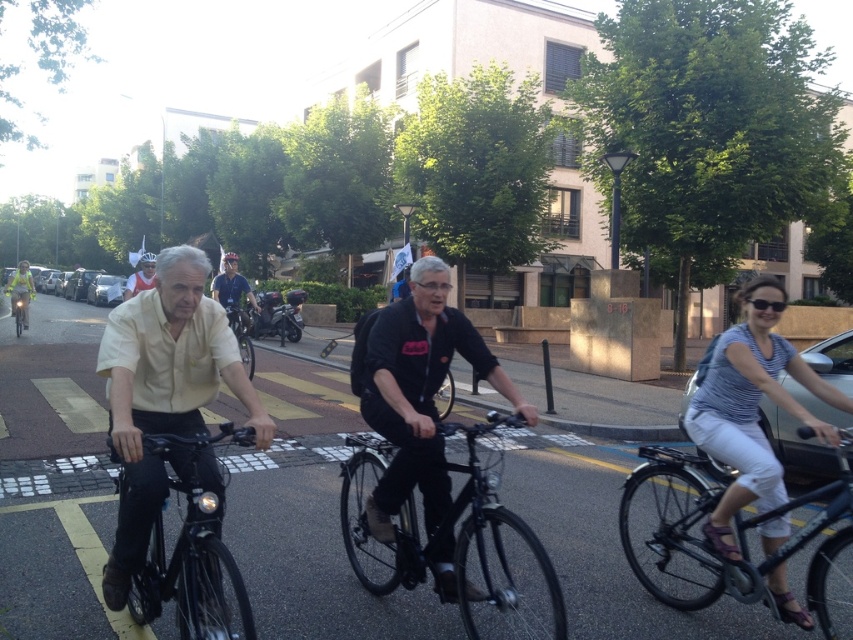
Who is higher up, striped cotton shirt at right or matte blue helmet at center?

striped cotton shirt at right is higher up.

Does striped cotton shirt at right have a lesser width compared to matte blue helmet at center?

No, striped cotton shirt at right is not thinner than matte blue helmet at center.

The width and height of the screenshot is (853, 640). What do you see at coordinates (751, 408) in the screenshot?
I see `striped cotton shirt at right` at bounding box center [751, 408].

Where is `striped cotton shirt at right`? The image size is (853, 640). striped cotton shirt at right is located at coordinates (751, 408).

Is black matte bicycle at center to the left of shiny black bicycle at center from the viewer's perspective?

Incorrect, black matte bicycle at center is not on the left side of shiny black bicycle at center.

Does black matte bicycle at center have a smaller size compared to shiny black bicycle at center?

No.

This screenshot has height=640, width=853. What do you see at coordinates (445, 532) in the screenshot? I see `black matte bicycle at center` at bounding box center [445, 532].

Identify the location of black matte bicycle at center. (445, 532).

Does striped cotton shirt at right have a greater height compared to black matte bicycle at center?

Yes, striped cotton shirt at right is taller than black matte bicycle at center.

Who is more distant from viewer, (815, 417) or (361, 456)?

Point (815, 417)

You are a GUI agent. You are given a task and a screenshot of the screen. Output one action in this format:
    pyautogui.click(x=<x>, y=<y>)
    Task: Click on the striped cotton shirt at right
    The image size is (853, 640).
    Given the screenshot: What is the action you would take?
    pyautogui.click(x=751, y=408)

Locate an element on the screen. striped cotton shirt at right is located at coordinates (751, 408).